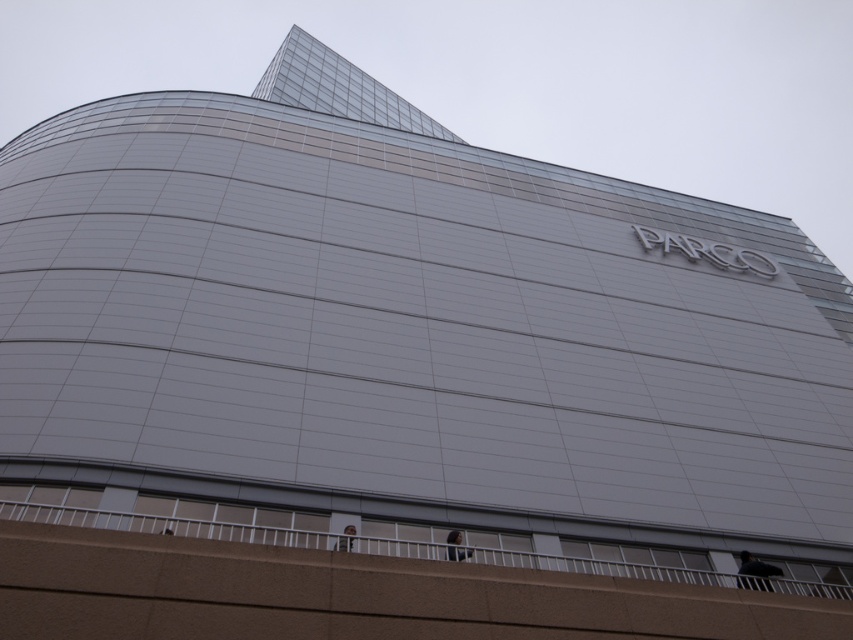
You are standing in front of the modern building and want to take a photo. You notice two points marked on the building. The first point is at coordinates point (450, 554) and the second point is at point (347, 525). Which point is closer to your camera when taking the photo?

Point (450, 554) is closer to the camera than point (347, 525).

You are a photographer standing in front of the modern building. You notice the dark gray fabric at lower right and the light brown hair at lower center. Which object is positioned lower in the scene?

The dark gray fabric at lower right is located below the light brown hair at lower center, so it is positioned lower in the scene.